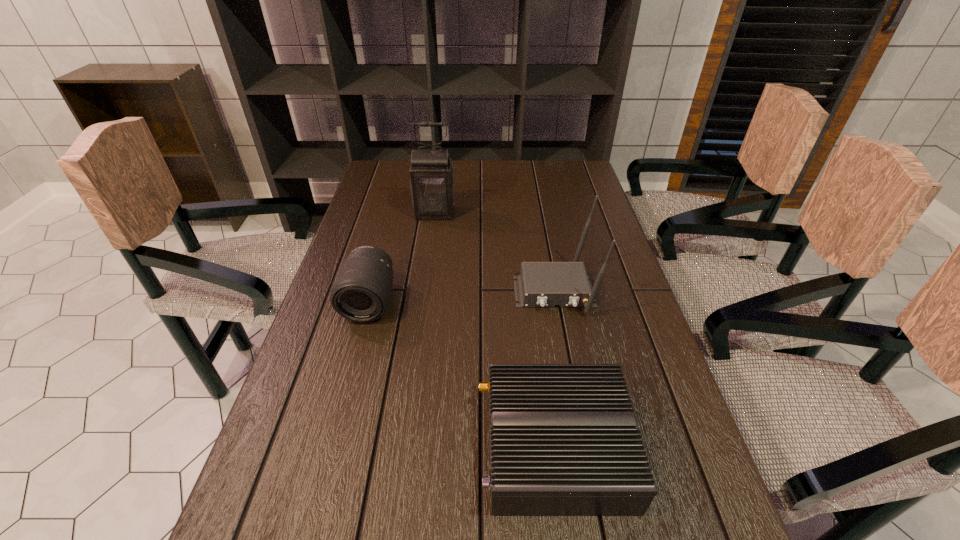
I want to click on the farthest object, so click(432, 184).

Identify the location of the second object from left to right. (432, 184).

At what (x,y) coordinates should I click in order to perform the action: click on the taller router. Please return your answer as a coordinate pair (x, y). Image resolution: width=960 pixels, height=540 pixels. Looking at the image, I should click on (540, 284).

At what (x,y) coordinates should I click in order to perform the action: click on the farther router. Please return your answer as a coordinate pair (x, y). This screenshot has height=540, width=960. Looking at the image, I should click on (540, 284).

Locate an element on the screen. telephoto lens is located at coordinates (361, 292).

Find the location of a particular element. This screenshot has width=960, height=540. the leftmost object is located at coordinates (361, 292).

Where is `the nearest object`? The width and height of the screenshot is (960, 540). the nearest object is located at coordinates (564, 440).

Identify the location of the shortest object. pyautogui.click(x=564, y=440).

Where is `free space located 0.180m on the front-facing side of the lantern`? Image resolution: width=960 pixels, height=540 pixels. free space located 0.180m on the front-facing side of the lantern is located at coordinates click(x=429, y=256).

This screenshot has height=540, width=960. What are the coordinates of `free space located 0.250m on the back of the second tallest object to connect cables` in the screenshot? It's located at (575, 406).